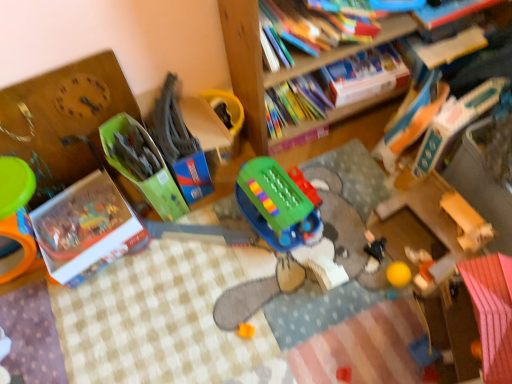
What are the coordinates of `vacant area that lies between orange matte cube at center, the 4th toy viewed from the right, and black plastic toy at center, positioned as the fifth toy in left-to-right order` in the screenshot? It's located at (310, 292).